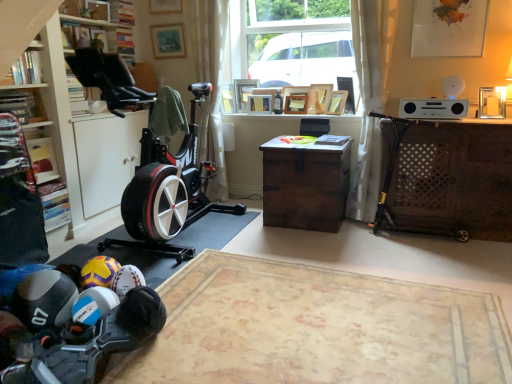
Identify the location of vacant space that is in between brown wooden desk at center, positioned as the second desk in right-to-left order, and rubberized black shoe at lower left, arranged as the 2th toy when viewed from the back. (239, 256).